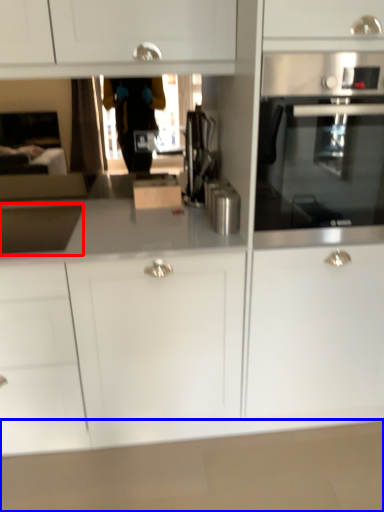
Question: Which object is further to the camera taking this photo, sink (highlighted by a red box) or counter top (highlighted by a blue box)?

Choices:
 (A) sink
 (B) counter top

Answer: (B)